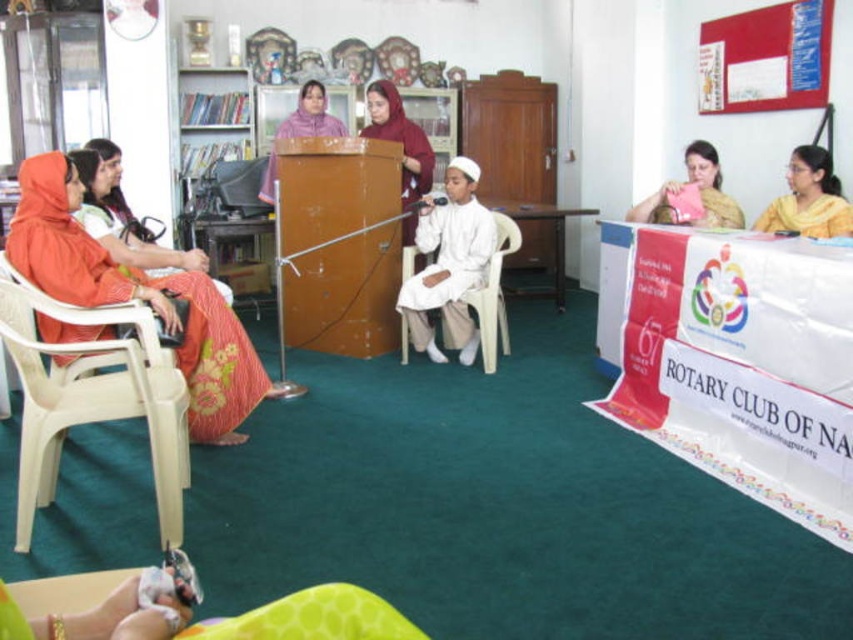
You are organizing a small workshop in the community hall and need to place a 2.5 meters long table between the translucent plastic chair at left and the maroon fabric headscarf at center. Is there enough space to fit the table between them?

The distance between the translucent plastic chair at left and the maroon fabric headscarf at center is 2.14 meters, which is shorter than the 2.5 meters required for the table. Therefore, the table cannot be placed between them.

You are organizing an event and need to place a large decoration on the surface that can support it. Based on the scene, which object between the translucent plastic chair at left and the pink fabric at center would be more suitable for placing the decoration?

The translucent plastic chair at left is bigger than the pink fabric at center, so it would be more suitable for placing the large decoration as it can provide a more stable and sturdy base.